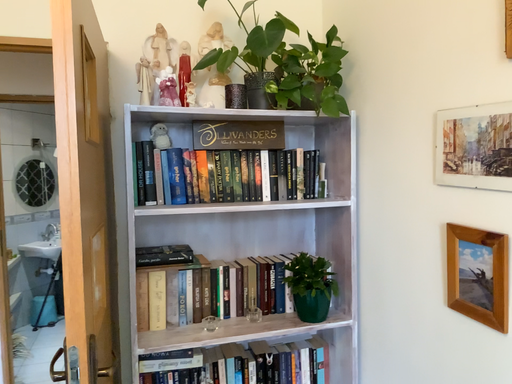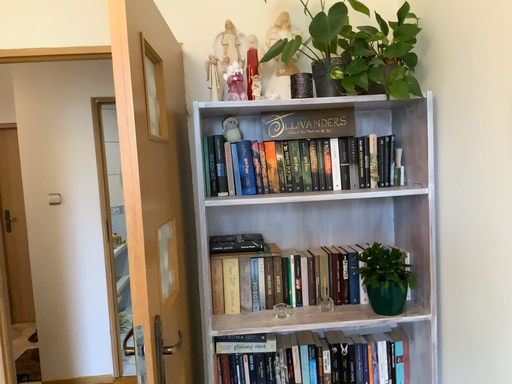
Question: Which way did the camera rotate in the video?

Choices:
 (A) rotated left
 (B) rotated right

Answer: (A)